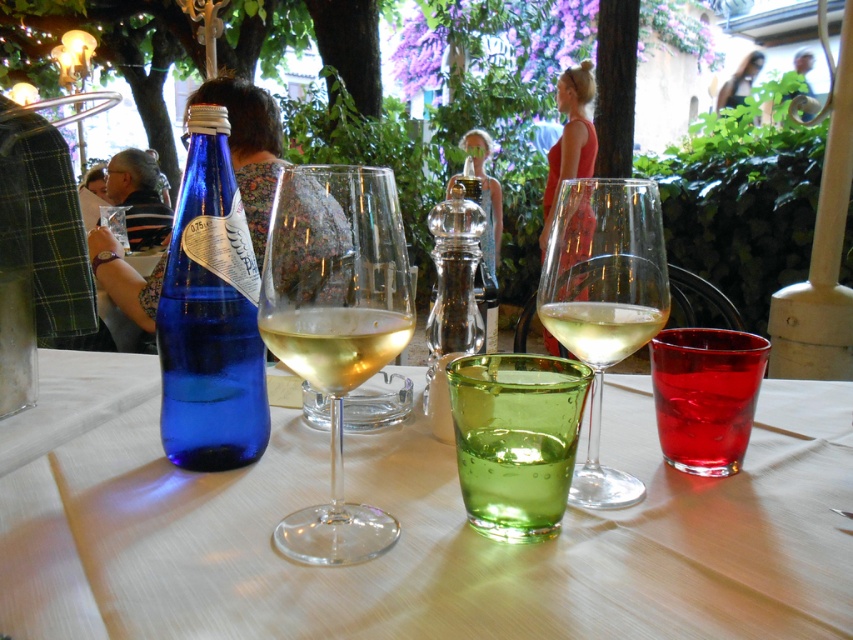
Question: Is translucent glass wine at center bigger than clear glass wine at center?

Choices:
 (A) yes
 (B) no

Answer: (B)

Question: Is green glass at center thinner than clear glass wine at center?

Choices:
 (A) no
 (B) yes

Answer: (B)

Question: Which point appears farthest from the camera in this image?

Choices:
 (A) (300, 285)
 (B) (566, 307)

Answer: (B)

Question: In this image, where is blue glass bottle at left located relative to translucent glass wine at center?

Choices:
 (A) above
 (B) below

Answer: (A)

Question: Which of the following is the farthest from the observer?

Choices:
 (A) transparent glass wine at center
 (B) green glass at center
 (C) blue glass bottle at left

Answer: (C)

Question: Considering the real-world distances, which object is farthest from the clear glass wine at center?

Choices:
 (A) clear glass pepper shaker at center
 (B) translucent glass wine at center

Answer: (B)